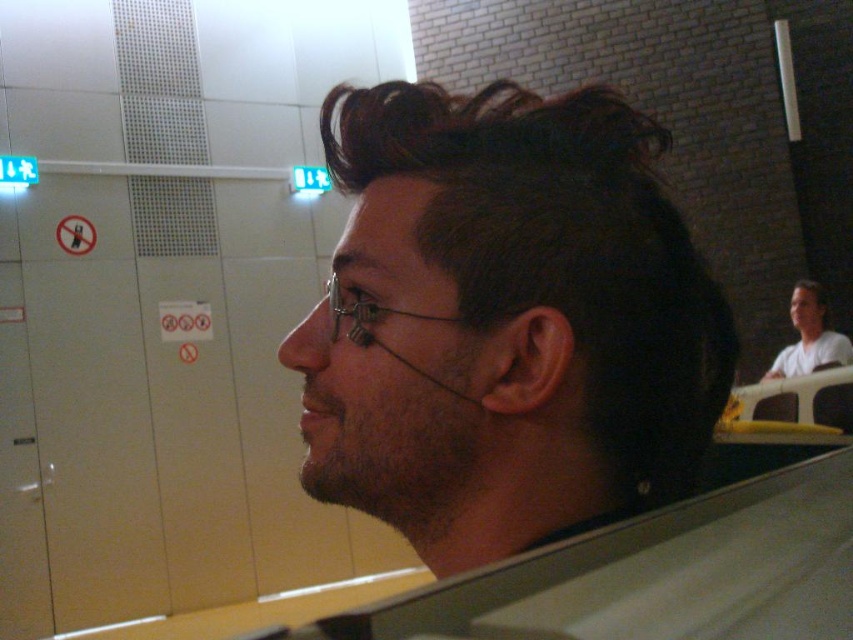
Which of these two, white matte shirt at upper right or clear plastic glasses at center, stands shorter?

With less height is clear plastic glasses at center.

Is point (809, 307) farther from camera compared to point (347, 298)?

Yes, it is.

Is point (793, 307) farther from viewer compared to point (372, 305)?

Yes, it is.

The width and height of the screenshot is (853, 640). I want to click on white matte shirt at upper right, so click(x=809, y=337).

Is point (387, 154) positioned after point (349, 298)?

Yes, it is behind point (349, 298).

Who is more forward, (456, 189) or (338, 292)?

Point (456, 189) is in front.

You are a GUI agent. You are given a task and a screenshot of the screen. Output one action in this format:
    pyautogui.click(x=<x>, y=<y>)
    Task: Click on the dark brown hair at center
    
    Given the screenshot: What is the action you would take?
    pyautogui.click(x=505, y=321)

Where is `dark brown hair at center`? dark brown hair at center is located at coordinates (505, 321).

Can you confirm if dark brown hair at center is positioned to the right of white matte shirt at upper right?

In fact, dark brown hair at center is to the left of white matte shirt at upper right.

Is point (312, 493) behind point (822, 321)?

No, it is in front of (822, 321).

Does point (395, 150) come farther from viewer compared to point (813, 349)?

No, (395, 150) is in front of (813, 349).

You are a GUI agent. You are given a task and a screenshot of the screen. Output one action in this format:
    pyautogui.click(x=<x>, y=<y>)
    Task: Click on the dark brown hair at center
    This screenshot has height=640, width=853.
    Given the screenshot: What is the action you would take?
    pyautogui.click(x=505, y=321)